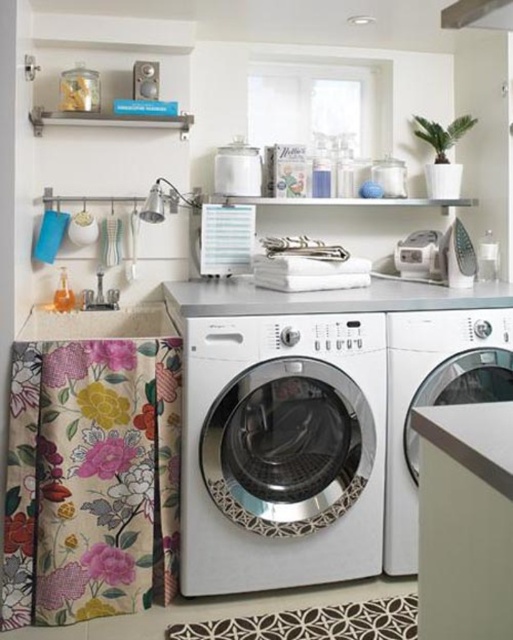
You are standing in the laundry room and want to reach the point marked by the coordinates point (312,422). Which object is located at that point?

The satin silver washing machine at center is located at point (312,422).

You are trying to decide where to place a new laundry basket that is the same size as the satin white washing machine at center. Based on the image, can the floral fabric laundry at left accommodate the new laundry basket without overlapping?

The floral fabric laundry at left is larger in size than the satin white washing machine at center. Since the laundry basket is the same size as the washing machine, the floral fabric laundry at left has enough space to accommodate it without overlapping.

You are a delivery person who needs to place a package between the floral fabric laundry at left and the satin white washing machine at center. The package is 1.2 meters long. Can you fit it in the space between them?

The space between the floral fabric laundry at left and the satin white washing machine at center is 1.13 meters. Since the package is 1.2 meters long, it cannot fit in the available space.